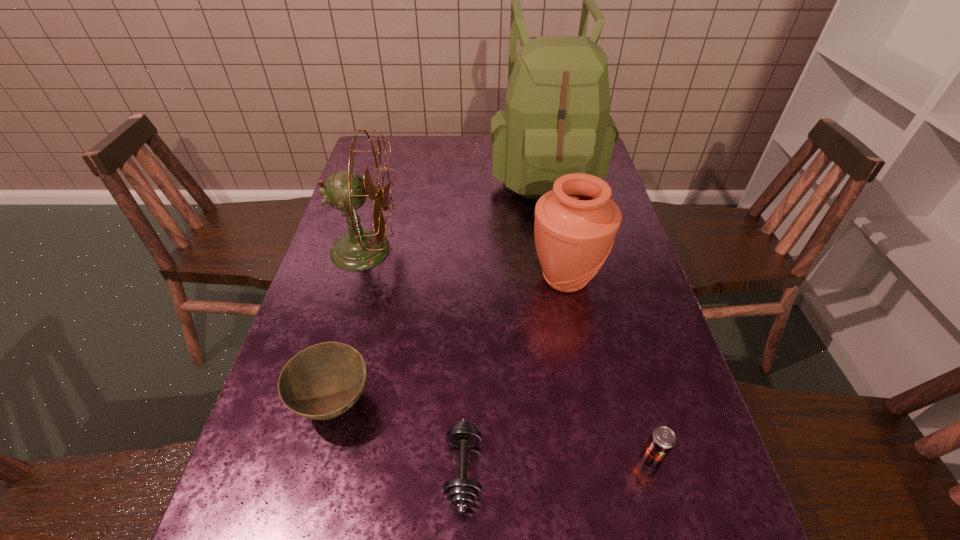
At what (x,y) coordinates should I click in order to perform the action: click on object positioned at the far right corner. Please return your answer as a coordinate pair (x, y). This screenshot has width=960, height=540. Looking at the image, I should click on (556, 121).

What are the coordinates of `free region at the far edge` in the screenshot? It's located at (449, 137).

Image resolution: width=960 pixels, height=540 pixels. What are the coordinates of `free region at the left edge` in the screenshot? It's located at (362, 338).

In the image, there is a desktop. Where is `free space at the right edge`? Image resolution: width=960 pixels, height=540 pixels. free space at the right edge is located at coordinates (647, 285).

Where is `free space between the bowl and the vase`? This screenshot has height=540, width=960. free space between the bowl and the vase is located at coordinates (450, 341).

Find the location of `empty space between the beer can and the fan`. empty space between the beer can and the fan is located at coordinates (508, 354).

Identify the location of vacant area that lies between the vase and the fan. (465, 264).

This screenshot has height=540, width=960. Identify the location of vacant space in between the backpack and the bowl. (439, 287).

Locate an element on the screen. vacant space that is in between the fourth shortest object and the dumbbell is located at coordinates (515, 374).

You are a GUI agent. You are given a task and a screenshot of the screen. Output one action in this format:
    pyautogui.click(x=<x>, y=<y>)
    Task: Click on the vacant area that lies between the beer can and the bowl
    
    Given the screenshot: What is the action you would take?
    pyautogui.click(x=492, y=431)